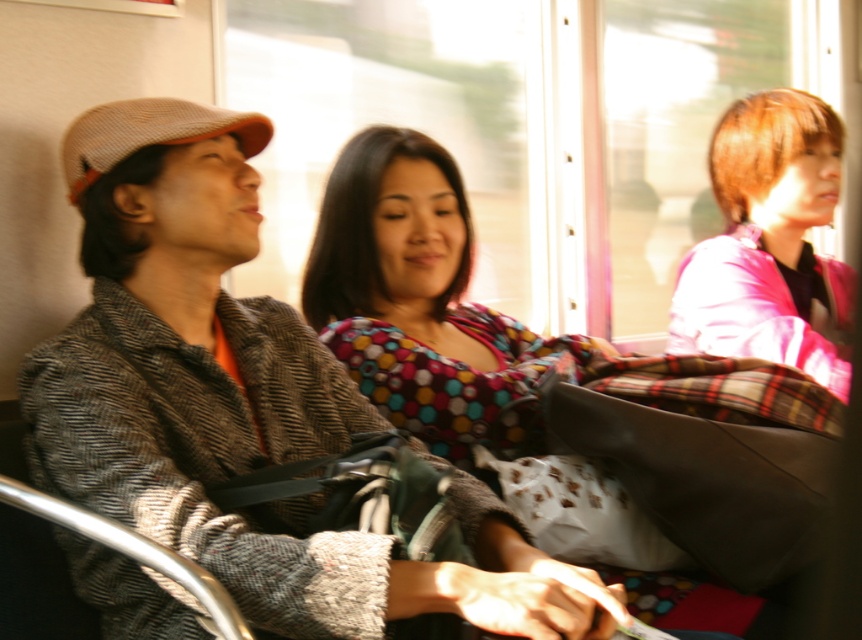
Question: Which point is closer to the camera?

Choices:
 (A) polka dot fabric dress at center
 (B) pink fabric at upper right

Answer: (A)

Question: Does polka dot fabric dress at center have a greater width compared to pink fabric at upper right?

Choices:
 (A) no
 (B) yes

Answer: (B)

Question: Is polka dot fabric dress at center bigger than pink fabric at upper right?

Choices:
 (A) yes
 (B) no

Answer: (A)

Question: Which point is closer to the camera taking this photo?

Choices:
 (A) 721,192
 (B) 353,180

Answer: (B)

Question: Is polka dot fabric dress at center closer to camera compared to pink fabric at upper right?

Choices:
 (A) no
 (B) yes

Answer: (B)